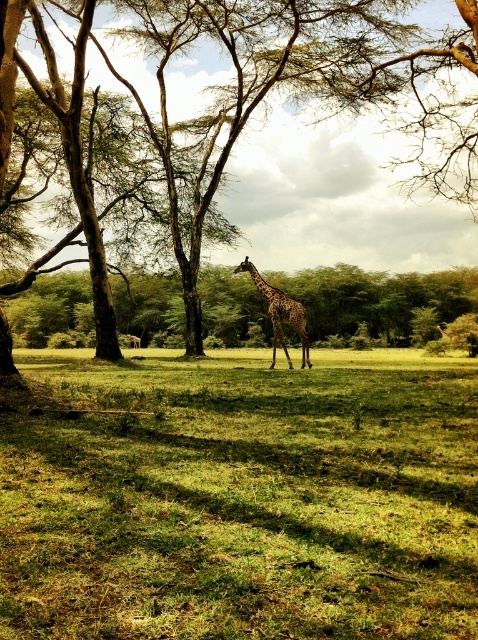
Question: Is brown textured tree at upper left to the left of spotted fur giraffe at center from the viewer's perspective?

Choices:
 (A) yes
 (B) no

Answer: (A)

Question: Which is nearer to the green grassy field at center?

Choices:
 (A) spotted fur giraffe at center
 (B) brown textured tree at upper left

Answer: (A)

Question: Which of the following is the farthest from the observer?

Choices:
 (A) [145, 388]
 (B) [242, 268]
 (C) [10, 26]

Answer: (B)

Question: Which of the following is the closest to the observer?

Choices:
 (A) brown textured tree at upper left
 (B) spotted fur giraffe at center

Answer: (A)

Question: Can you confirm if green grassy field at center is positioned below spotted fur giraffe at center?

Choices:
 (A) no
 (B) yes

Answer: (B)

Question: Does brown textured tree at upper left have a lesser width compared to spotted fur giraffe at center?

Choices:
 (A) yes
 (B) no

Answer: (B)